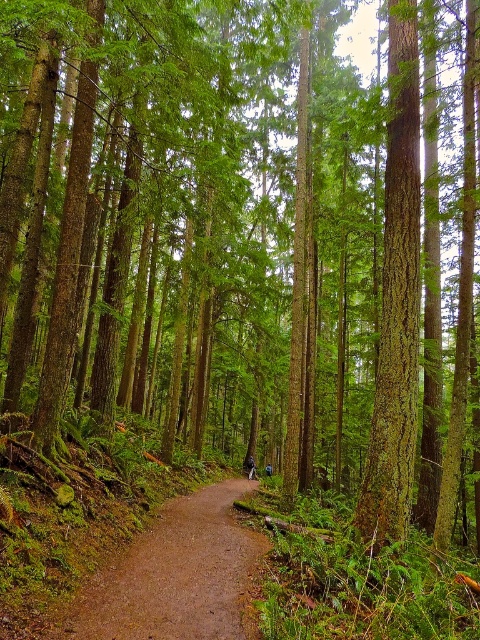
Does green rough bark tree at center have a lesser height compared to dark blue jeans at center?

Yes, green rough bark tree at center is shorter than dark blue jeans at center.

Who is taller, green rough bark tree at center or dark blue jeans at center?

dark blue jeans at center is taller.

Which is in front, point (410, 476) or point (249, 476)?

Point (410, 476) is in front.

Find the location of a particular element. This screenshot has height=640, width=480. green rough bark tree at center is located at coordinates (396, 298).

Does point (213, 605) come in front of point (268, 468)?

Yes.

Is brown dirt path at center bigger than blue fabric jacket at center?

Yes, brown dirt path at center is bigger than blue fabric jacket at center.

The height and width of the screenshot is (640, 480). What do you see at coordinates (178, 576) in the screenshot? I see `brown dirt path at center` at bounding box center [178, 576].

I want to click on brown dirt path at center, so click(x=178, y=576).

Locate an element on the screen. The width and height of the screenshot is (480, 640). dark blue jeans at center is located at coordinates (251, 467).

At what (x,y) coordinates should I click in order to perform the action: click on dark blue jeans at center. Please return your answer as a coordinate pair (x, y). The image size is (480, 640). Looking at the image, I should click on (251, 467).